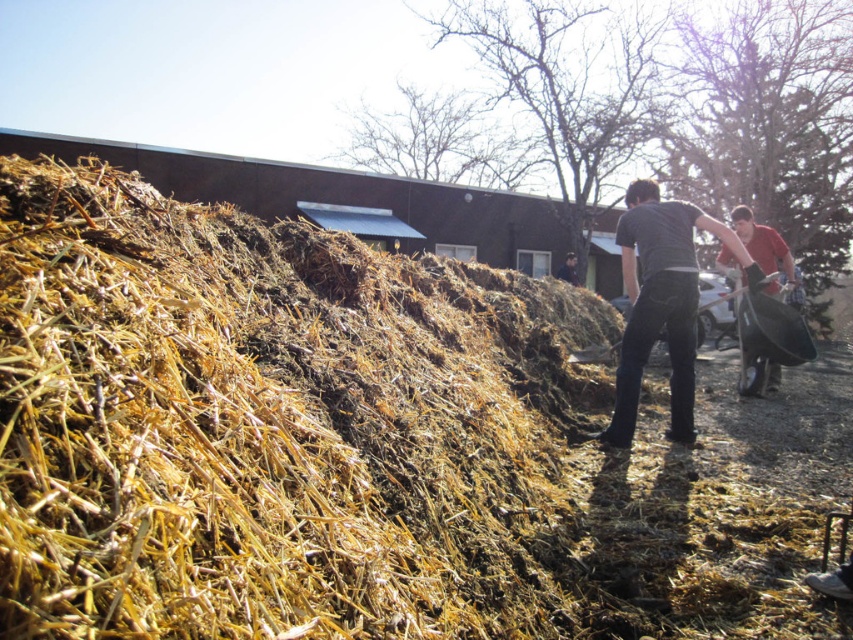
Question: Which object is positioned farthest from the brown straw at center?

Choices:
 (A) matte black shovel at right
 (B) dark gray shirt at center

Answer: (A)

Question: Which of the following is the closest to the observer?

Choices:
 (A) matte black shovel at right
 (B) brown straw at center

Answer: (B)

Question: Does brown straw at center have a larger size compared to dark gray shirt at center?

Choices:
 (A) yes
 (B) no

Answer: (B)

Question: Which is nearer to the dark gray shirt at center?

Choices:
 (A) brown straw at center
 (B) matte black shovel at right

Answer: (B)

Question: Considering the relative positions of brown straw at center and matte black shovel at right in the image provided, where is brown straw at center located with respect to matte black shovel at right?

Choices:
 (A) right
 (B) left

Answer: (B)

Question: Is brown straw at center in front of matte black shovel at right?

Choices:
 (A) yes
 (B) no

Answer: (A)